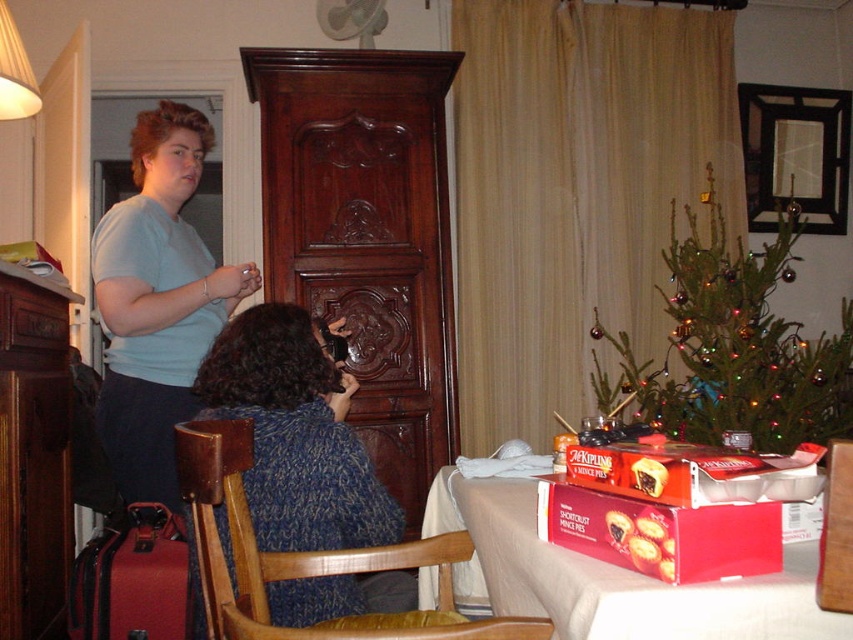
Between blue knitted sweater at center and light blue t-shirt at upper left, which one has less height?

Standing shorter between the two is blue knitted sweater at center.

Which is below, blue knitted sweater at center or light blue t-shirt at upper left?

Positioned lower is blue knitted sweater at center.

You are a GUI agent. You are given a task and a screenshot of the screen. Output one action in this format:
    pyautogui.click(x=<x>, y=<y>)
    Task: Click on the blue knitted sweater at center
    This screenshot has width=853, height=640.
    Given the screenshot: What is the action you would take?
    pyautogui.click(x=296, y=435)

Can you confirm if blue knitted sweater at center is positioned to the right of green matte christmas tree at right?

Incorrect, blue knitted sweater at center is not on the right side of green matte christmas tree at right.

Is blue knitted sweater at center behind green matte christmas tree at right?

No, blue knitted sweater at center is closer to the viewer.

The height and width of the screenshot is (640, 853). Identify the location of blue knitted sweater at center. (296, 435).

Is light blue t-shirt at upper left taller than dark wood armoire at center?

Indeed, light blue t-shirt at upper left has a greater height compared to dark wood armoire at center.

Is light blue t-shirt at upper left to the right of dark wood armoire at center from the viewer's perspective?

Indeed, light blue t-shirt at upper left is positioned on the right side of dark wood armoire at center.

Is point (171, 212) less distant than point (3, 384)?

No, (171, 212) is behind (3, 384).

Locate an element on the screen. light blue t-shirt at upper left is located at coordinates (157, 301).